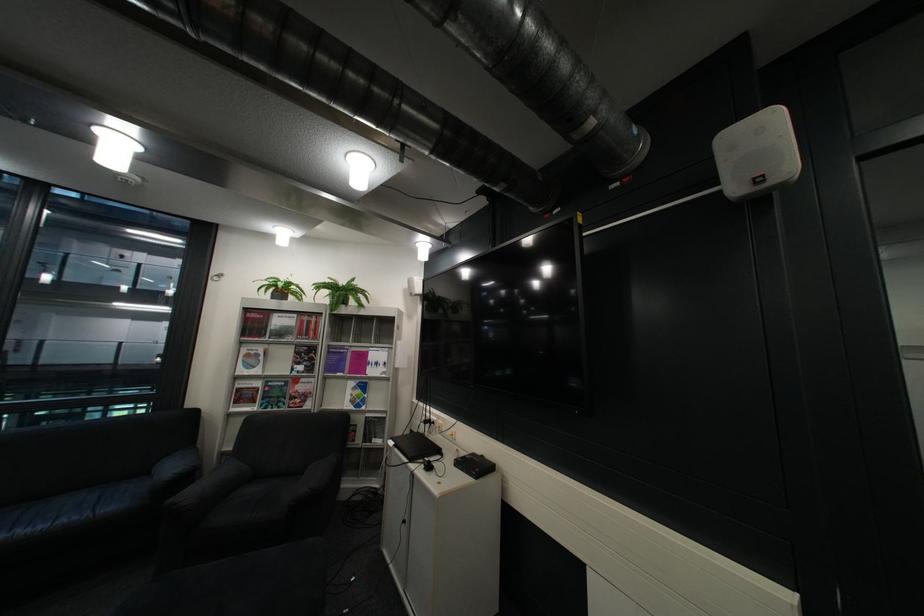
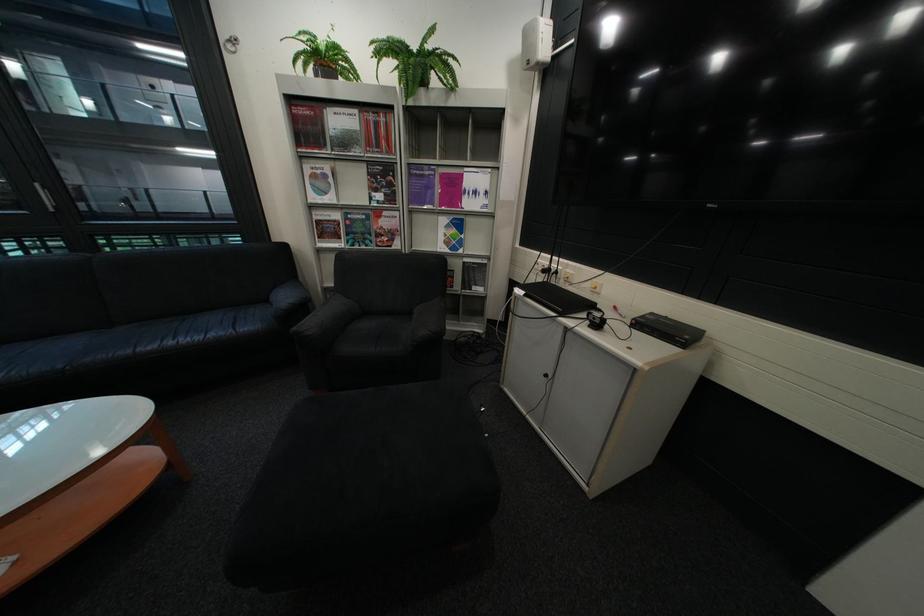
In the second image, find the point that corresponds to (x=58, y=527) in the first image.

(213, 338)